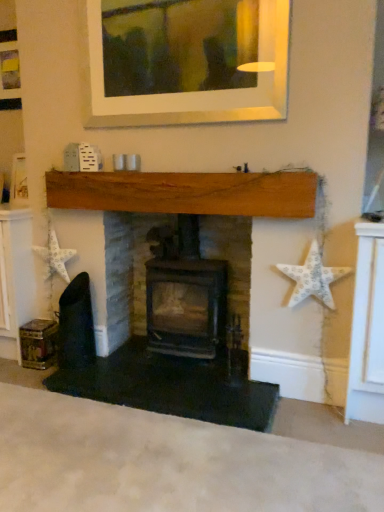
Question: Does white textured star at right, the first starfish from the right, have a greater height compared to black cast iron stove at center, which appears as the first fireplace when viewed from the right?

Choices:
 (A) yes
 (B) no

Answer: (B)

Question: From a real-world perspective, is white textured star at right, the second starfish when ordered from back to front, on top of black cast iron stove at center, which appears as the first fireplace when viewed from the right?

Choices:
 (A) no
 (B) yes

Answer: (B)

Question: Does white textured star at right, the first starfish viewed from the front, come in front of black cast iron stove at center, which appears as the first fireplace when viewed from the right?

Choices:
 (A) yes
 (B) no

Answer: (A)

Question: Can you confirm if white textured star at right, the first starfish viewed from the front, is bigger than black cast iron stove at center, placed as the 2th fireplace when sorted from left to right?

Choices:
 (A) yes
 (B) no

Answer: (B)

Question: From the image's perspective, does white textured star at right, the second starfish when ordered from back to front, appear lower than black cast iron stove at center, which appears as the first fireplace when viewed from the right?

Choices:
 (A) yes
 (B) no

Answer: (B)

Question: Is black cast iron stove at center, placed as the 2th fireplace when sorted from left to right, at the back of white textured star at right, the second starfish when ordered from back to front?

Choices:
 (A) yes
 (B) no

Answer: (B)

Question: From the image's perspective, does white paper star at left, which is counted as the second starfish, starting from the front, appear lower than black cast iron stove at center, which appears as the first fireplace when viewed from the right?

Choices:
 (A) no
 (B) yes

Answer: (A)

Question: Is white paper star at left, the first starfish viewed from the back, facing towards black cast iron stove at center, which appears as the first fireplace when viewed from the right?

Choices:
 (A) no
 (B) yes

Answer: (A)

Question: Can you confirm if white paper star at left, the first starfish viewed from the back, is smaller than black cast iron stove at center, placed as the 2th fireplace when sorted from left to right?

Choices:
 (A) no
 (B) yes

Answer: (B)

Question: From a real-world perspective, is white paper star at left, which appears as the first starfish when viewed from the left, beneath black cast iron stove at center, placed as the 2th fireplace when sorted from left to right?

Choices:
 (A) no
 (B) yes

Answer: (A)

Question: Is white paper star at left, the second starfish when ordered from right to left, behind black cast iron stove at center, which appears as the first fireplace when viewed from the right?

Choices:
 (A) no
 (B) yes

Answer: (B)

Question: From the image's perspective, would you say white paper star at left, the second starfish when ordered from right to left, is positioned over black cast iron stove at center, placed as the 2th fireplace when sorted from left to right?

Choices:
 (A) no
 (B) yes

Answer: (B)

Question: From the image's perspective, is white paper star at left, the first starfish viewed from the back, on top of white textured star at right, the first starfish viewed from the front?

Choices:
 (A) no
 (B) yes

Answer: (B)